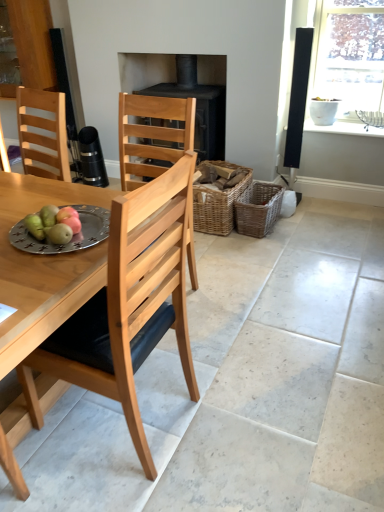
Question: From the image's perspective, is woven brown basket at center, the 1th basket positioned from the left, positioned above or below silver metallic plate at table left?

Choices:
 (A) above
 (B) below

Answer: (A)

Question: Relative to silver metallic plate at table left, is woven brown basket at center, the second basket positioned from the right, in front or behind?

Choices:
 (A) front
 (B) behind

Answer: (B)

Question: Estimate the real-world distances between objects in this image. Which object is farther from the woven brown basket at center, the 1th basket positioned from the left?

Choices:
 (A) natural wood chair at center
 (B) woven brown basket at center-right, acting as the 1th basket starting from the right
 (C) green matte pears at table left
 (D) clear glass window at upper right
 (E) black matte fireplace at center

Answer: (C)

Question: Which of these objects is positioned farthest from the natural wood chair at center?

Choices:
 (A) green matte pears at table left
 (B) silver metallic plate at table left
 (C) woven brown basket at center-right, arranged as the second basket when viewed from the left
 (D) black matte fireplace at center
 (E) clear glass window at upper right

Answer: (E)